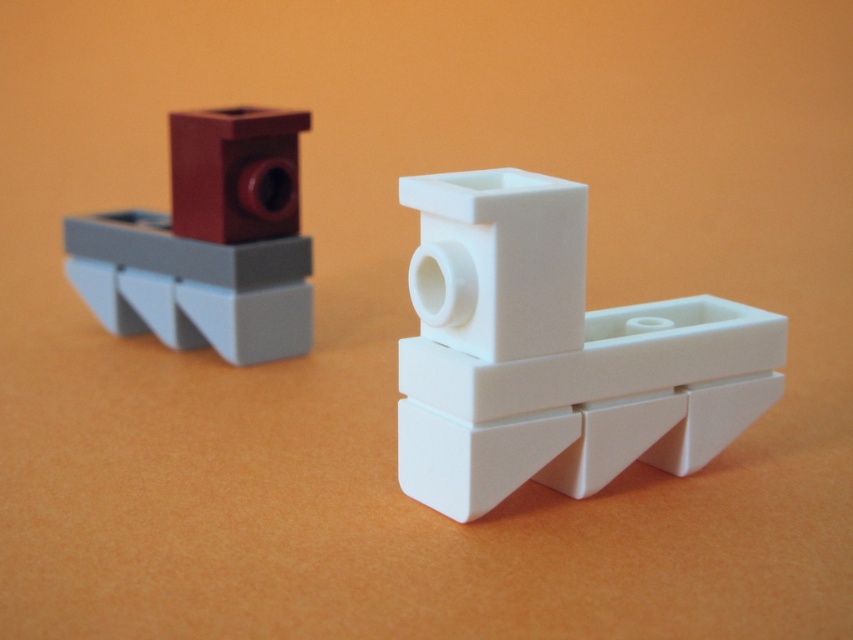
Question: Is white plastic boat at center to the right of matte red brick at upper left from the viewer's perspective?

Choices:
 (A) yes
 (B) no

Answer: (A)

Question: Which point appears farthest from the camera in this image?

Choices:
 (A) (570, 396)
 (B) (282, 172)

Answer: (B)

Question: Does white plastic boat at center appear over matte red brick at upper left?

Choices:
 (A) yes
 (B) no

Answer: (B)

Question: Does white plastic boat at center have a larger size compared to matte red brick at upper left?

Choices:
 (A) no
 (B) yes

Answer: (B)

Question: Among these objects, which one is farthest from the camera?

Choices:
 (A) matte red brick at upper left
 (B) white plastic boat at center

Answer: (A)